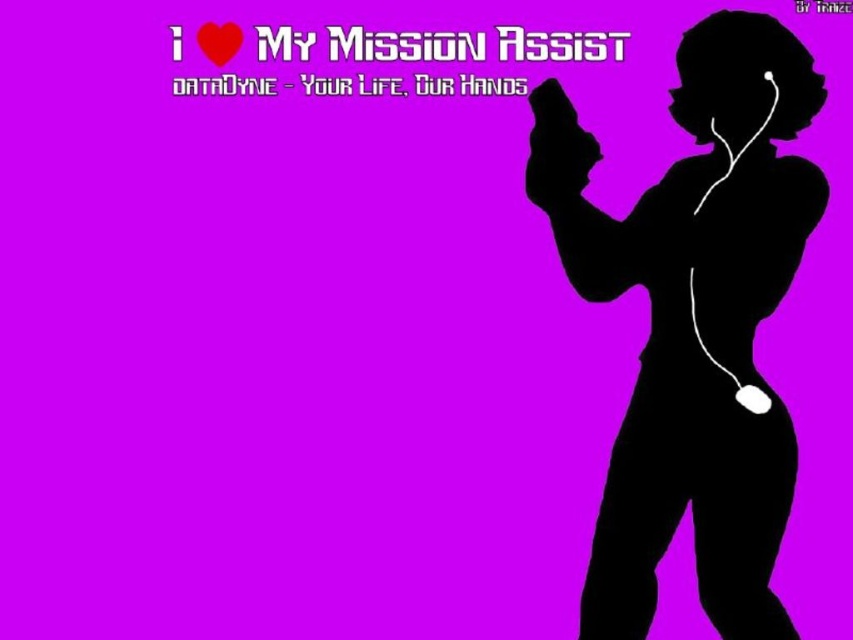
You are a GUI agent. You are given a task and a screenshot of the screen. Output one action in this format:
    pyautogui.click(x=<x>, y=<y>)
    Task: Click on the black silhouette at right
    
    Given the screenshot: What is the action you would take?
    pyautogui.click(x=695, y=323)